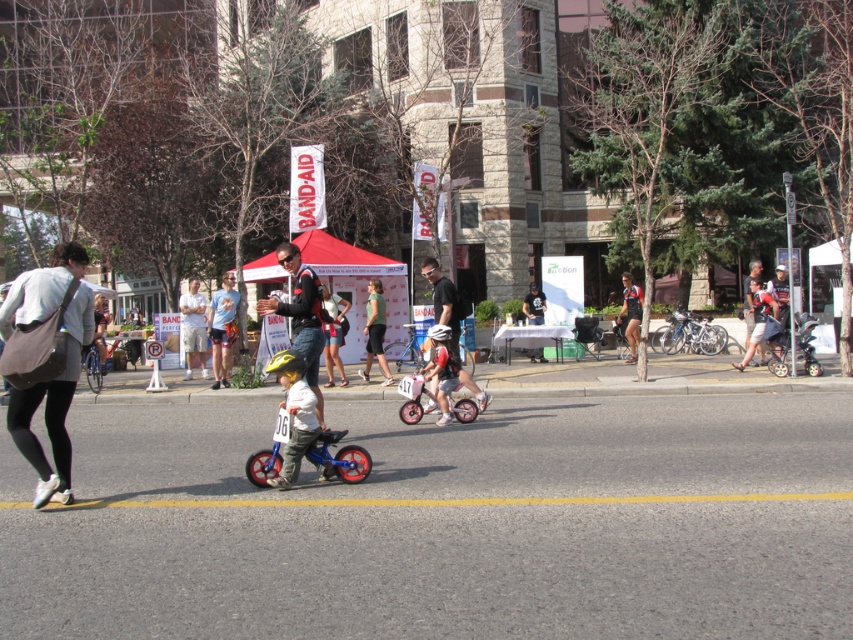
Who is positioned more to the left, gray fabric bag at left or black matte shirt at center?

From the viewer's perspective, gray fabric bag at left appears more on the left side.

I want to click on gray fabric bag at left, so click(x=53, y=404).

Locate an element on the screen. gray fabric bag at left is located at coordinates (53, 404).

Find the location of a particular element. matte black shorts at center is located at coordinates (759, 320).

Does matte black shorts at center lie behind black matte shirt at center?

No.

Who is more forward, (753, 326) or (537, 349)?

Point (753, 326) is in front.

Image resolution: width=853 pixels, height=640 pixels. I want to click on matte black shorts at center, so coord(759,320).

Based on the photo, who is positioned more to the right, matte black shorts at right or black matte shirt at center?

From the viewer's perspective, matte black shorts at right appears more on the right side.

Does matte black shorts at right appear under black matte shirt at center?

Incorrect, matte black shorts at right is not positioned below black matte shirt at center.

Who is more forward, (631, 308) or (541, 358)?

Point (631, 308) is in front.

Where is `matte black shorts at right`? matte black shorts at right is located at coordinates pos(630,314).